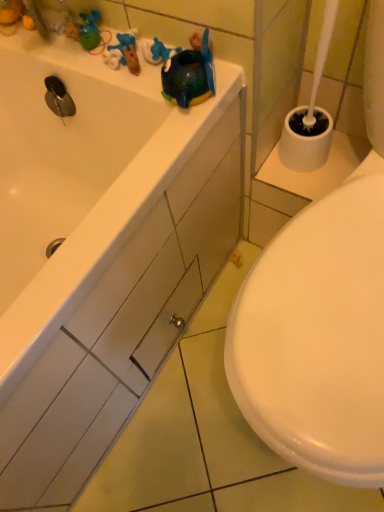
Question: Relative to white glossy drawer at center, is white glossy bathtub at upper left in front or behind?

Choices:
 (A) behind
 (B) front

Answer: (B)

Question: Is white glossy bathtub at upper left wider or thinner than white glossy drawer at center?

Choices:
 (A) thin
 (B) wide

Answer: (B)

Question: Do you think white glossy bathtub at upper left is within white glossy drawer at center, or outside of it?

Choices:
 (A) inside
 (B) outside

Answer: (B)

Question: From a real-world perspective, relative to white glossy bathtub at upper left, is white glossy drawer at center vertically above or below?

Choices:
 (A) below
 (B) above

Answer: (A)

Question: Considering their positions, is white glossy drawer at center located in front of or behind white glossy bathtub at upper left?

Choices:
 (A) front
 (B) behind

Answer: (B)

Question: Looking at the image, does white glossy drawer at center seem bigger or smaller compared to white glossy bathtub at upper left?

Choices:
 (A) big
 (B) small

Answer: (B)

Question: In terms of height, does white glossy drawer at center look taller or shorter compared to white glossy bathtub at upper left?

Choices:
 (A) short
 (B) tall

Answer: (A)